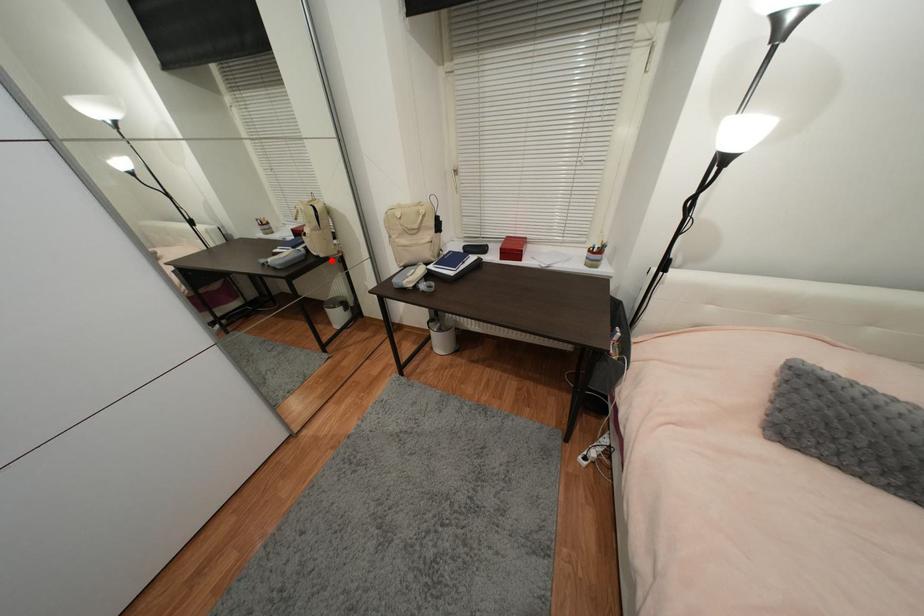
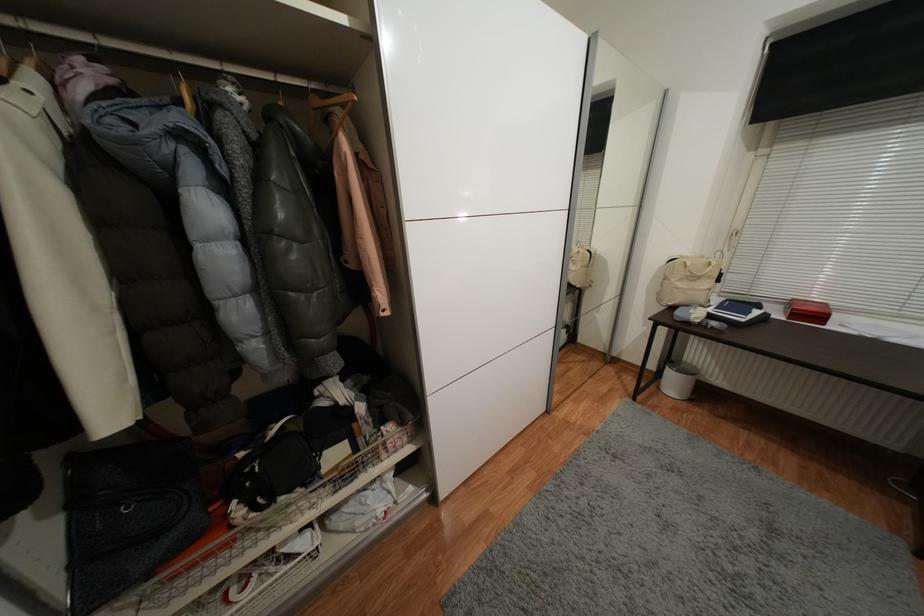
In the second image, find the point that corresponds to the highlighted location in the first image.

(582, 291)